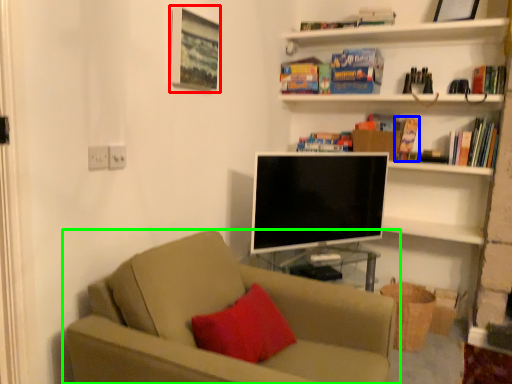
Question: Estimate the real-world distances between objects in this image. Which object is farther from picture frame (highlighted by a red box), paperback book (highlighted by a blue box) or studio couch (highlighted by a green box)?

Choices:
 (A) paperback book
 (B) studio couch

Answer: (A)